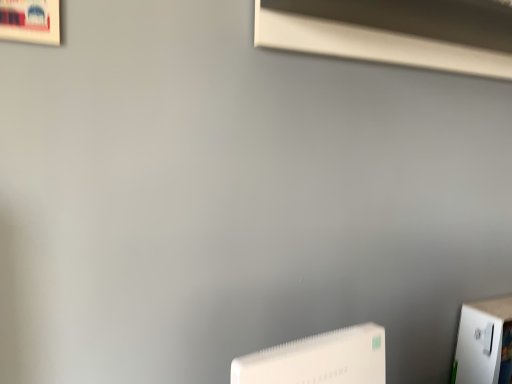
Question: From a real-world perspective, is white plastic wii at lower center positioned above or below white smooth window sill at upper center?

Choices:
 (A) above
 (B) below

Answer: (B)

Question: Is point (374, 380) closer or farther from the camera than point (485, 31)?

Choices:
 (A) farther
 (B) closer

Answer: (B)

Question: Based on their sizes in the image, would you say white plastic wii at lower center is bigger or smaller than white smooth window sill at upper center?

Choices:
 (A) big
 (B) small

Answer: (B)

Question: Based on their sizes in the image, would you say white smooth window sill at upper center is bigger or smaller than white plastic wii at lower center?

Choices:
 (A) small
 (B) big

Answer: (B)

Question: From the image's perspective, is white smooth window sill at upper center located above or below white plastic wii at lower center?

Choices:
 (A) below
 (B) above

Answer: (B)

Question: In the image, is white smooth window sill at upper center on the left side or the right side of white plastic wii at lower center?

Choices:
 (A) left
 (B) right

Answer: (B)

Question: Is white smooth window sill at upper center taller or shorter than white plastic wii at lower center?

Choices:
 (A) short
 (B) tall

Answer: (A)